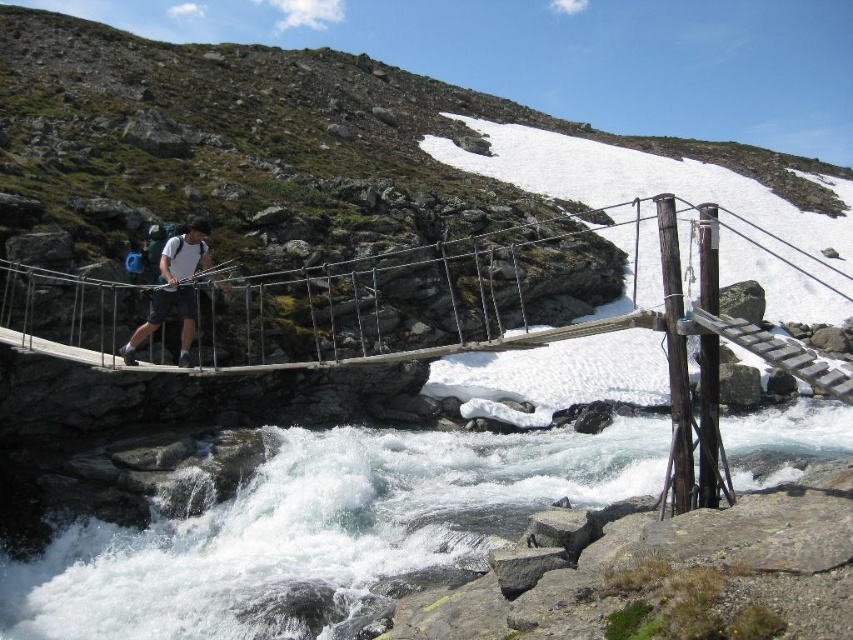
Is the position of white frothy water at lower center less distant than that of matte white shirt at center?

Yes.

Looking at this image, does white frothy water at lower center come behind matte white shirt at center?

That is False.

Is point (412, 547) positioned before point (181, 362)?

No, it is not.

Identify the location of white frothy water at lower center. pyautogui.click(x=321, y=534).

Looking at this image, is wooden suspension bridge at center smaller than matte white shirt at center?

No.

Is point (523, 289) less distant than point (177, 285)?

That is False.

This screenshot has width=853, height=640. In order to click on wooden suspension bridge at center in this screenshot , I will do `click(355, 317)`.

Where is `white frothy water at lower center`? This screenshot has width=853, height=640. white frothy water at lower center is located at coordinates (321, 534).

Does white frothy water at lower center appear under wooden suspension bridge at center?

Yes, white frothy water at lower center is below wooden suspension bridge at center.

Is point (630, 433) in front of point (672, 420)?

No, it is behind (672, 420).

Find the location of `white frothy water at lower center`. white frothy water at lower center is located at coordinates pyautogui.click(x=321, y=534).